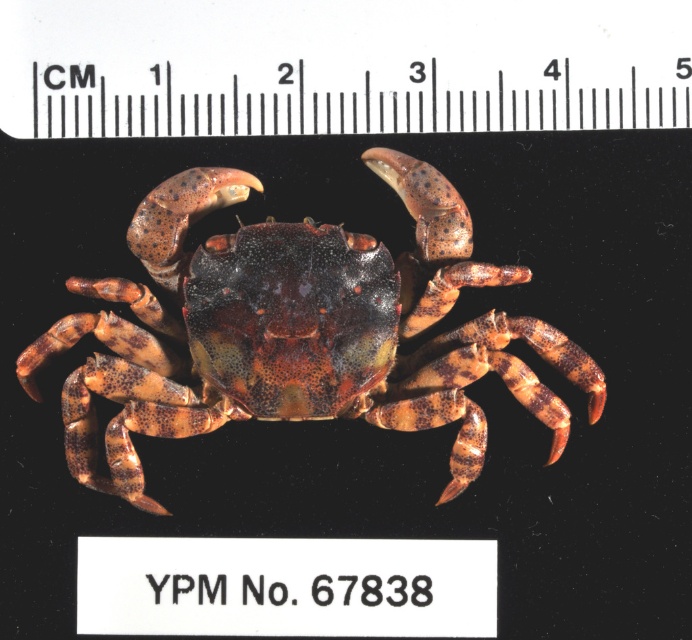
Can you confirm if speckled brown crab at center is positioned below black plastic ruler at upper center?

Yes, speckled brown crab at center is below black plastic ruler at upper center.

How distant is speckled brown crab at center from black plastic ruler at upper center?

speckled brown crab at center is 10.23 inches away from black plastic ruler at upper center.

Between point (63, 326) and point (612, 3), which one is positioned behind?

The point (63, 326) is behind.

Find the location of `speckled brown crab at center`. speckled brown crab at center is located at coordinates (298, 330).